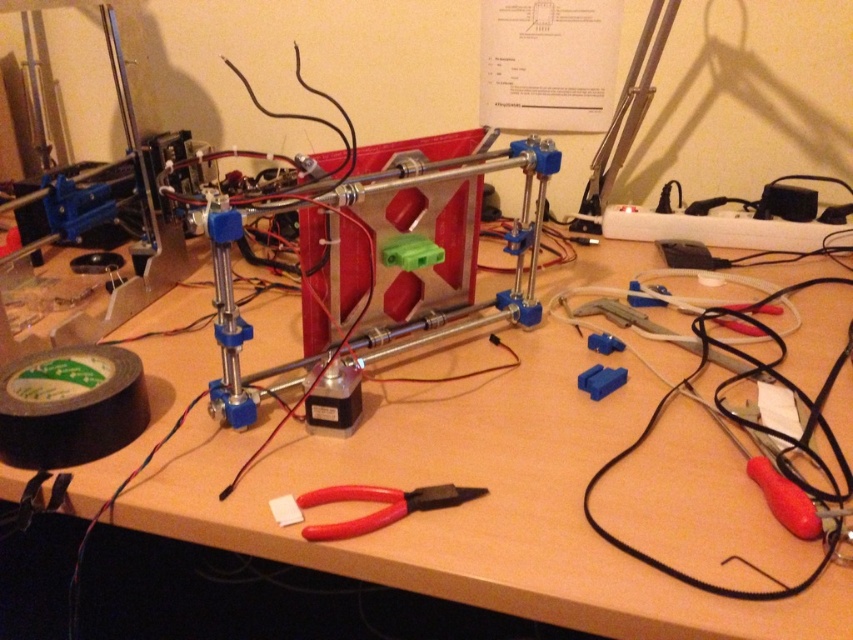
Question: Considering the relative positions of wooden table at center and red plastic pliers at center in the image provided, where is wooden table at center located with respect to red plastic pliers at center?

Choices:
 (A) above
 (B) below

Answer: (A)

Question: Is wooden table at center further to the viewer compared to red plastic pliers at center?

Choices:
 (A) no
 (B) yes

Answer: (A)

Question: Which point is farther to the camera?

Choices:
 (A) red plastic pliers at center
 (B) wooden table at center

Answer: (A)

Question: Which object appears closest to the camera in this image?

Choices:
 (A) red plastic pliers at center
 (B) wooden table at center

Answer: (B)

Question: Which of the following is the farthest from the observer?

Choices:
 (A) (610, 602)
 (B) (345, 538)

Answer: (B)

Question: Is wooden table at center positioned at the back of red plastic pliers at center?

Choices:
 (A) yes
 (B) no

Answer: (B)